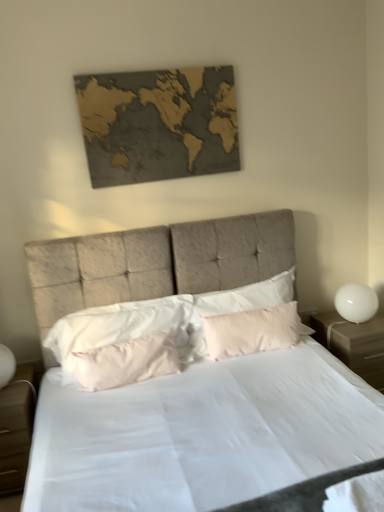
Question: From a real-world perspective, is matte beige bed at center located higher than light brown wood nightstand at lower left, marked as the first nightstand in a left-to-right arrangement?

Choices:
 (A) no
 (B) yes

Answer: (B)

Question: Is matte beige bed at center smaller than light brown wood nightstand at lower left, which appears as the 2th nightstand when viewed from the right?

Choices:
 (A) no
 (B) yes

Answer: (A)

Question: Considering the relative sizes of matte beige bed at center and light brown wood nightstand at lower left, marked as the first nightstand in a left-to-right arrangement, in the image provided, is matte beige bed at center taller than light brown wood nightstand at lower left, marked as the first nightstand in a left-to-right arrangement,?

Choices:
 (A) yes
 (B) no

Answer: (A)

Question: Does matte beige bed at center have a larger size compared to light brown wood nightstand at lower left, marked as the first nightstand in a left-to-right arrangement?

Choices:
 (A) no
 (B) yes

Answer: (B)

Question: Is matte beige bed at center oriented away from light brown wood nightstand at lower left, marked as the first nightstand in a left-to-right arrangement?

Choices:
 (A) yes
 (B) no

Answer: (B)

Question: Looking at the image, does white glossy nightstand at right, the 2th nightstand from the left, seem bigger or smaller compared to white glossy sphere at right?

Choices:
 (A) big
 (B) small

Answer: (A)

Question: Do you think white glossy nightstand at right, positioned as the first nightstand in right-to-left order, is within white glossy sphere at right, or outside of it?

Choices:
 (A) outside
 (B) inside

Answer: (A)

Question: Considering the positions of white glossy nightstand at right, the 2th nightstand from the left, and white glossy sphere at right in the image, is white glossy nightstand at right, the 2th nightstand from the left, wider or thinner than white glossy sphere at right?

Choices:
 (A) wide
 (B) thin

Answer: (A)

Question: From the image's perspective, relative to white glossy sphere at right, is white glossy nightstand at right, the 2th nightstand from the left, above or below?

Choices:
 (A) below
 (B) above

Answer: (A)

Question: In the image, is pink satin pillow at center, the 2th pillow when ordered from right to left, positioned in front of or behind light brown wood nightstand at lower left, marked as the first nightstand in a left-to-right arrangement?

Choices:
 (A) front
 (B) behind

Answer: (B)

Question: Visually, is pink satin pillow at center, positioned as the 2th pillow in left-to-right order, positioned to the left or to the right of light brown wood nightstand at lower left, which appears as the 2th nightstand when viewed from the right?

Choices:
 (A) right
 (B) left

Answer: (A)

Question: Is pink satin pillow at center, positioned as the 2th pillow in left-to-right order, bigger or smaller than light brown wood nightstand at lower left, marked as the first nightstand in a left-to-right arrangement?

Choices:
 (A) big
 (B) small

Answer: (B)

Question: Is pink satin pillow at center, the 2th pillow when ordered from right to left, wider or thinner than light brown wood nightstand at lower left, marked as the first nightstand in a left-to-right arrangement?

Choices:
 (A) wide
 (B) thin

Answer: (B)

Question: Is white glossy nightstand at right, positioned as the first nightstand in right-to-left order, spatially inside gold textured map at upper center, or outside of it?

Choices:
 (A) inside
 (B) outside

Answer: (B)

Question: Is white glossy nightstand at right, positioned as the first nightstand in right-to-left order, wider or thinner than gold textured map at upper center?

Choices:
 (A) wide
 (B) thin

Answer: (A)